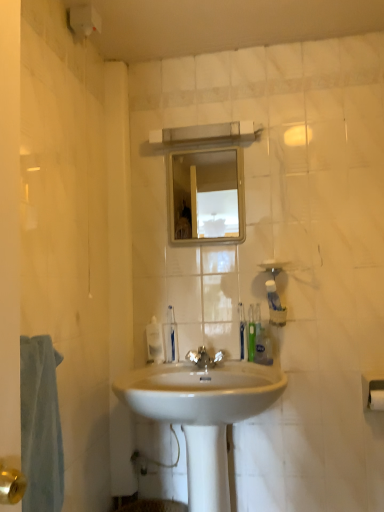
Question: Is clear glass mirror at upper center surrounding white matte toilet paper at lower right?

Choices:
 (A) no
 (B) yes

Answer: (A)

Question: Is clear glass mirror at upper center next to white matte toilet paper at lower right and touching it?

Choices:
 (A) yes
 (B) no

Answer: (B)

Question: Does clear glass mirror at upper center have a larger size compared to white matte toilet paper at lower right?

Choices:
 (A) yes
 (B) no

Answer: (A)

Question: Could you tell me if clear glass mirror at upper center is turned towards white matte toilet paper at lower right?

Choices:
 (A) yes
 (B) no

Answer: (B)

Question: Is clear glass mirror at upper center looking in the opposite direction of white matte toilet paper at lower right?

Choices:
 (A) yes
 (B) no

Answer: (B)

Question: In terms of height, does green plastic toothbrush at center, marked as the 2th toiletry in a left-to-right arrangement, look taller or shorter compared to green plastic toothbrush at right, positioned as the third toiletry in left-to-right order?

Choices:
 (A) tall
 (B) short

Answer: (B)

Question: Visually, is green plastic toothbrush at center, marked as the fourth toiletry in a right-to-left arrangement, positioned to the left or to the right of green plastic toothbrush at right, arranged as the 3th toiletry when viewed from the right?

Choices:
 (A) right
 (B) left

Answer: (B)

Question: Considering the positions of green plastic toothbrush at center, marked as the 2th toiletry in a left-to-right arrangement, and green plastic toothbrush at right, positioned as the third toiletry in left-to-right order, in the image, is green plastic toothbrush at center, marked as the 2th toiletry in a left-to-right arrangement, bigger or smaller than green plastic toothbrush at right, positioned as the third toiletry in left-to-right order,?

Choices:
 (A) small
 (B) big

Answer: (A)

Question: From the image's perspective, is green plastic toothbrush at center, marked as the fourth toiletry in a right-to-left arrangement, positioned above or below green plastic toothbrush at right, arranged as the 3th toiletry when viewed from the right?

Choices:
 (A) above
 (B) below

Answer: (B)

Question: From the image's perspective, is white plastic toothbrush at center, placed as the fifth toiletry when sorted from right to left, located above or below translucent plastic soap dispenser at center?

Choices:
 (A) above
 (B) below

Answer: (A)

Question: Looking at the image, does white plastic toothbrush at center, which is counted as the 1th toiletry, starting from the left, seem bigger or smaller compared to translucent plastic soap dispenser at center?

Choices:
 (A) big
 (B) small

Answer: (B)

Question: In terms of height, does white plastic toothbrush at center, which is counted as the 1th toiletry, starting from the left, look taller or shorter compared to translucent plastic soap dispenser at center?

Choices:
 (A) short
 (B) tall

Answer: (B)

Question: Visually, is white plastic toothbrush at center, placed as the fifth toiletry when sorted from right to left, positioned to the left or to the right of translucent plastic soap dispenser at center?

Choices:
 (A) left
 (B) right

Answer: (B)

Question: Based on their sizes in the image, would you say white matte soap at center is bigger or smaller than green plastic toothbrush at center, marked as the fourth toiletry in a right-to-left arrangement?

Choices:
 (A) small
 (B) big

Answer: (A)

Question: From the image's perspective, is white matte soap at center above or below green plastic toothbrush at center, marked as the 2th toiletry in a left-to-right arrangement?

Choices:
 (A) below
 (B) above

Answer: (B)